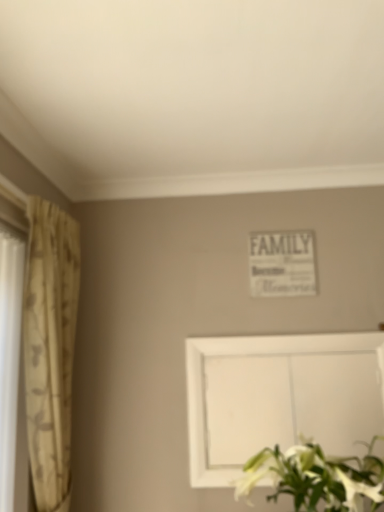
The image size is (384, 512). What do you see at coordinates (279, 398) in the screenshot?
I see `white matte picture frame at lower center` at bounding box center [279, 398].

This screenshot has width=384, height=512. Find the location of `beige floral fabric curtain at left`. beige floral fabric curtain at left is located at coordinates (50, 347).

Locate an element on the screen. white matte picture frame at lower center is located at coordinates (279, 398).

Could white matte picture frame at lower center be considered to be inside white matte floral arrangement at lower right?

Definitely not — white matte picture frame at lower center is not inside white matte floral arrangement at lower right.

Is white matte floral arrangement at lower right thinner than white matte picture frame at lower center?

Incorrect, the width of white matte floral arrangement at lower right is not less than that of white matte picture frame at lower center.

Does white matte floral arrangement at lower right have a larger size compared to white matte picture frame at lower center?

Correct, white matte floral arrangement at lower right is larger in size than white matte picture frame at lower center.

Is white matte floral arrangement at lower right at the left side of white matte picture frame at lower center?

In fact, white matte floral arrangement at lower right is to the right of white matte picture frame at lower center.

Is white matte picture frame at lower center to the right of white matte floral arrangement at lower right from the viewer's perspective?

In fact, white matte picture frame at lower center is to the left of white matte floral arrangement at lower right.

Is white matte picture frame at lower center located outside white matte floral arrangement at lower right?

Yes, white matte picture frame at lower center is not within white matte floral arrangement at lower right.

What's the angular difference between white matte picture frame at lower center and white matte floral arrangement at lower right's facing directions?

white matte picture frame at lower center and white matte floral arrangement at lower right are facing 0.315 degrees away from each other.

From the image's perspective, which is below, white matte picture frame at lower center or white matte floral arrangement at lower right?

From the image's view, white matte floral arrangement at lower right is below.

Is beige floral fabric curtain at left with white matte floral arrangement at lower right?

No, beige floral fabric curtain at left is not making contact with white matte floral arrangement at lower right.

From a real-world perspective, which is physically below, beige floral fabric curtain at left or white matte floral arrangement at lower right?

From a 3D spatial view, white matte floral arrangement at lower right is below.

Is beige floral fabric curtain at left looking in the opposite direction of white matte floral arrangement at lower right?

beige floral fabric curtain at left does not have its back to white matte floral arrangement at lower right.

Do you think beige floral fabric curtain at left is within white matte floral arrangement at lower right, or outside of it?

beige floral fabric curtain at left exists outside the volume of white matte floral arrangement at lower right.

Can beige floral fabric curtain at left be found inside white matte picture frame at lower center?

Definitely not — beige floral fabric curtain at left is not inside white matte picture frame at lower center.

The height and width of the screenshot is (512, 384). Find the location of `curtain on the left of white matte picture frame at lower center`. curtain on the left of white matte picture frame at lower center is located at coordinates (50, 347).

Is white matte picture frame at lower center aimed at beige floral fabric curtain at left?

No, white matte picture frame at lower center is not oriented towards beige floral fabric curtain at left.

Considering the sizes of objects white matte picture frame at lower center and beige floral fabric curtain at left in the image provided, who is shorter, white matte picture frame at lower center or beige floral fabric curtain at left?

white matte picture frame at lower center.

Which object is positioned more to the right, white matte floral arrangement at lower right or beige floral fabric curtain at left?

From the viewer's perspective, white matte floral arrangement at lower right appears more on the right side.

Considering the sizes of objects white matte floral arrangement at lower right and beige floral fabric curtain at left in the image provided, who is smaller, white matte floral arrangement at lower right or beige floral fabric curtain at left?

Smaller between the two is beige floral fabric curtain at left.

From the picture: Is white matte floral arrangement at lower right not close to beige floral fabric curtain at left?

No.

Is white matte floral arrangement at lower right shorter than beige floral fabric curtain at left?

Correct, white matte floral arrangement at lower right is not as tall as beige floral fabric curtain at left.

Could you measure the distance between beige floral fabric curtain at left and white matte picture frame at lower center?

beige floral fabric curtain at left is 32.38 inches from white matte picture frame at lower center.

Considering the relative sizes of beige floral fabric curtain at left and white matte picture frame at lower center in the image provided, is beige floral fabric curtain at left shorter than white matte picture frame at lower center?

In fact, beige floral fabric curtain at left may be taller than white matte picture frame at lower center.

How different are the orientations of beige floral fabric curtain at left and white matte picture frame at lower center in degrees?

89.6 degrees.

Is beige floral fabric curtain at left wider than white matte picture frame at lower center?

Yes, beige floral fabric curtain at left is wider than white matte picture frame at lower center.

Locate an element on the screen. The image size is (384, 512). picture frame that appears on the left of white matte floral arrangement at lower right is located at coordinates (279, 398).

Locate an element on the screen. The height and width of the screenshot is (512, 384). picture frame behind the white matte floral arrangement at lower right is located at coordinates (279, 398).

From the image, which object appears to be nearer to white matte floral arrangement at lower right, beige floral fabric curtain at left or white matte picture frame at lower center?

white matte picture frame at lower center.

Based on their spatial positions, is beige floral fabric curtain at left or white matte floral arrangement at lower right closer to white matte picture frame at lower center?

Based on the image, white matte floral arrangement at lower right appears to be nearer to white matte picture frame at lower center.

Estimate the real-world distances between objects in this image. Which object is closer to white matte floral arrangement at lower right, white matte picture frame at lower center or beige floral fabric curtain at left?

white matte picture frame at lower center lies closer to white matte floral arrangement at lower right than the other object.

Estimate the real-world distances between objects in this image. Which object is further from beige floral fabric curtain at left, white matte picture frame at lower center or white matte floral arrangement at lower right?

Among the two, white matte floral arrangement at lower right is located further to beige floral fabric curtain at left.

Based on their spatial positions, is white matte floral arrangement at lower right or beige floral fabric curtain at left closer to white matte picture frame at lower center?

white matte floral arrangement at lower right.

When comparing their distances from beige floral fabric curtain at left, does white matte floral arrangement at lower right or white matte picture frame at lower center seem further?

white matte floral arrangement at lower right is positioned further to the anchor beige floral fabric curtain at left.

Locate an element on the screen. This screenshot has width=384, height=512. picture frame between beige floral fabric curtain at left and white matte floral arrangement at lower right is located at coordinates (279, 398).